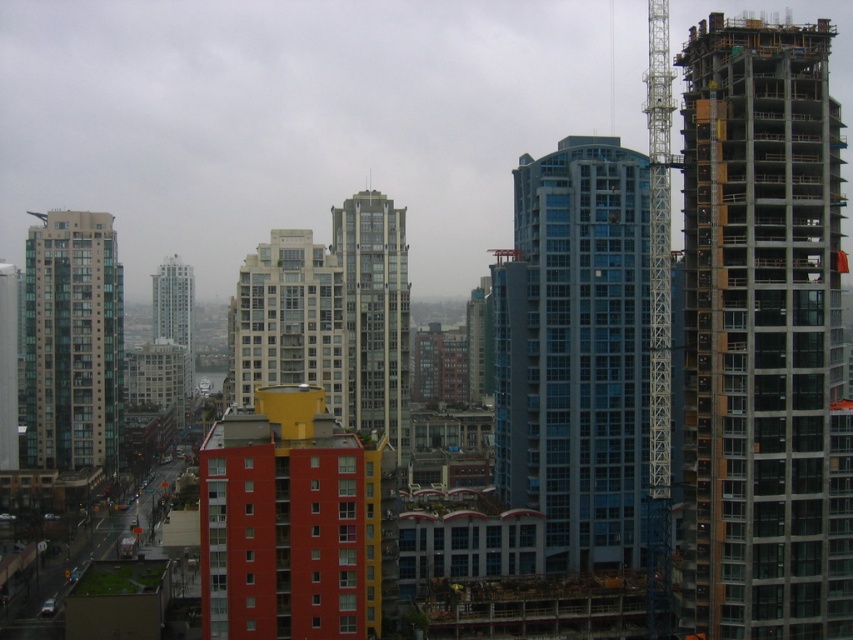
Question: Which object appears farthest from the camera in this image?

Choices:
 (A) metallic gray crane at right
 (B) matte glass skyscraper at center
 (C) glassy steel building at center

Answer: (B)

Question: Based on their relative distances, which object is farther from the metallic gray crane at right?

Choices:
 (A) concrete/wooden construction at right
 (B) blue glass building at center
 (C) glassy steel building at center
 (D) matte glass skyscraper at center

Answer: (D)

Question: Can you confirm if concrete/wooden construction at right is positioned above glassy steel building at center?

Choices:
 (A) no
 (B) yes

Answer: (B)

Question: Does matte glass building at left appear over matte glass building at center?

Choices:
 (A) yes
 (B) no

Answer: (A)

Question: Does blue glass building at center have a smaller size compared to matte glass building at center?

Choices:
 (A) no
 (B) yes

Answer: (B)

Question: Among these points, which one is farthest from the camera?

Choices:
 (A) (772, 488)
 (B) (398, 339)

Answer: (B)